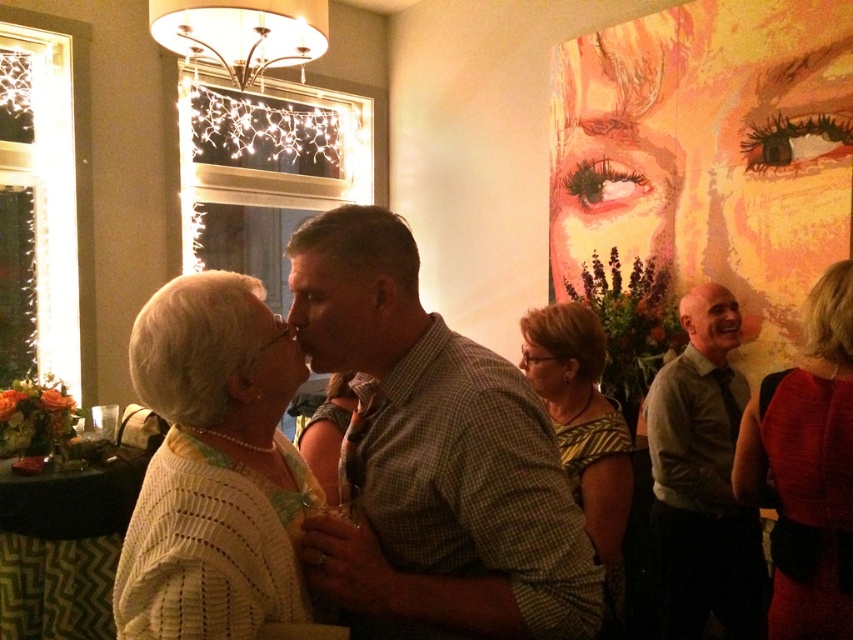
Consider the image. You are a photographer at the event and want to capture a group photo. The white knitted sweater at center and the shiny red dress at right are in your frame. Since you want to ensure both outfits are visible, which one might require you to adjust your camera angle to accommodate its size?

The white knitted sweater at center has a larger width than the shiny red dress at right, so you might need to adjust your camera angle to accommodate the white knitted sweater at center to ensure it fits properly in the frame.

You are standing at the entrance of the room and want to find the white knitted sweater at center. Based on the coordinates provided in the description, in which general direction should you look to locate it?

The white knitted sweater at center is located at coordinates point (213, 467), which places it towards the lower right of the image from your perspective at the entrance. So you should look towards the lower right direction to find it.